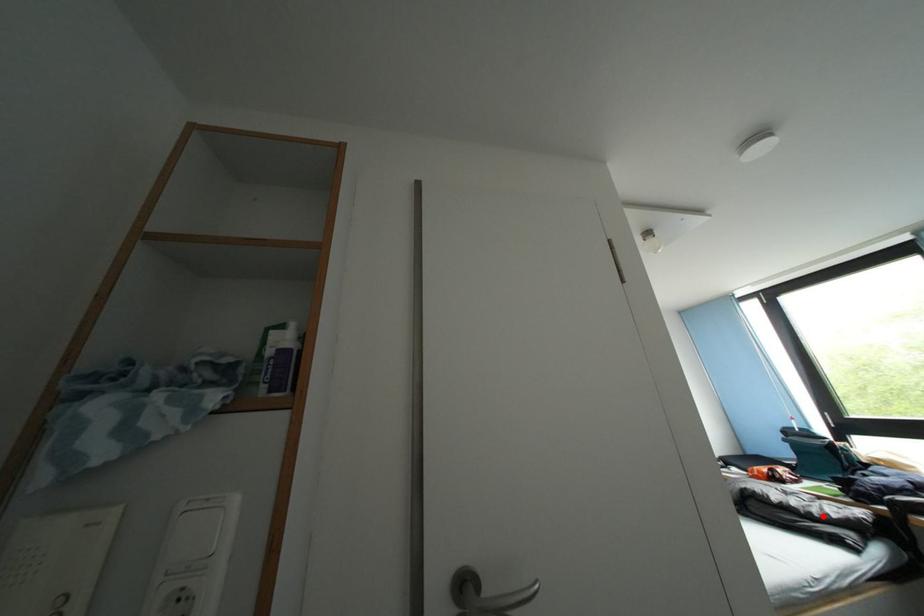
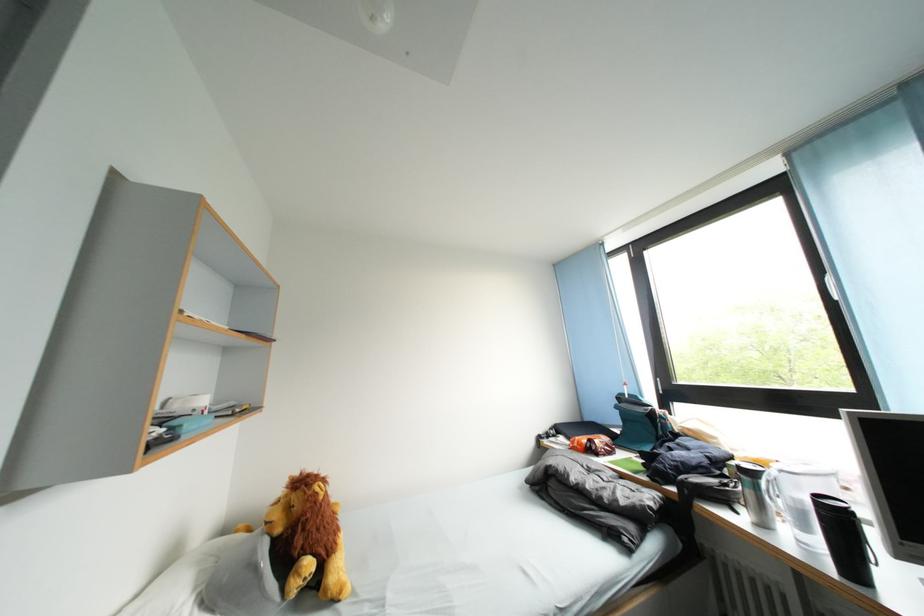
Where in the second image is the point corresponding to the highlighted location from the first image?

(614, 501)